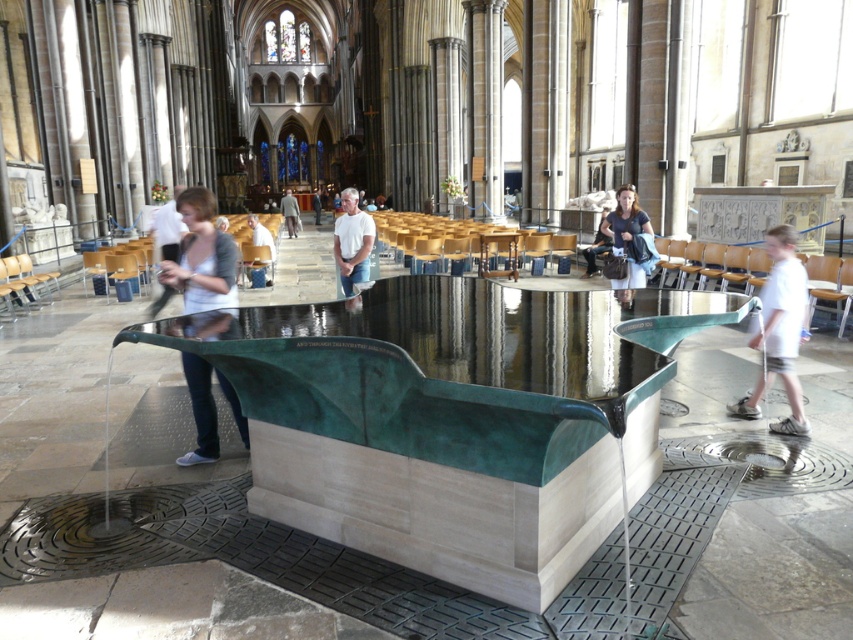
Can you confirm if matte black jacket at left is bigger than dark blue jeans at center?

Yes.

Consider the image. Between matte black jacket at left and dark blue jeans at center, which one has less height?

Standing shorter between the two is dark blue jeans at center.

Locate an element on the screen. matte black jacket at left is located at coordinates pyautogui.click(x=202, y=257).

Image resolution: width=853 pixels, height=640 pixels. What are the coordinates of `matte black jacket at left` in the screenshot? It's located at (202, 257).

Based on the photo, who is lower down, dark blue jeans at center or white shirt at center?

Positioned lower is dark blue jeans at center.

Between dark blue jeans at center and white shirt at center, which one is positioned higher?

Positioned higher is white shirt at center.

Does point (602, 216) come behind point (254, 244)?

No, it is in front of (254, 244).

You are a GUI agent. You are given a task and a screenshot of the screen. Output one action in this format:
    pyautogui.click(x=<x>, y=<y>)
    Task: Click on the dark blue jeans at center
    Image resolution: width=853 pixels, height=640 pixels.
    Given the screenshot: What is the action you would take?
    pyautogui.click(x=596, y=246)

Does point (181, 464) lie in front of point (260, 243)?

That is True.

Is the position of matte black jacket at left more distant than that of white shirt at center?

No, matte black jacket at left is closer to the viewer.

This screenshot has width=853, height=640. What are the coordinates of `matte black jacket at left` in the screenshot? It's located at (202, 257).

Identify the location of matte black jacket at left. The height and width of the screenshot is (640, 853). (202, 257).